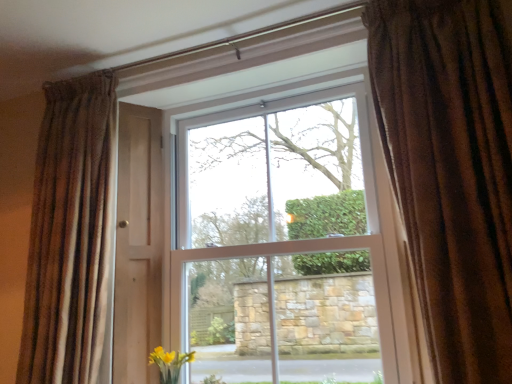
What is the approximate width of white plastic window at center?

white plastic window at center is 16.60 centimeters wide.

The height and width of the screenshot is (384, 512). What do you see at coordinates (451, 170) in the screenshot? I see `brown textured curtain at right, the 2th curtain when ordered from left to right` at bounding box center [451, 170].

Locate an element on the screen. The image size is (512, 384). brown textured curtain at left, which is the 1th curtain in left-to-right order is located at coordinates (71, 233).

The height and width of the screenshot is (384, 512). I want to click on white plastic window at center, so click(267, 231).

Is point (37, 329) closer or farther from the camera than point (158, 245)?

Clearly, point (37, 329) is closer to the camera than point (158, 245).

Consider the image. Is brown textured curtain at left, marked as the second curtain in a front-to-back arrangement, facing towards white plastic window at center?

No, brown textured curtain at left, marked as the second curtain in a front-to-back arrangement, is not facing towards white plastic window at center.

What's the angular difference between brown textured curtain at left, which is counted as the first curtain, starting from the back, and white plastic window at center's facing directions?

3.55 degrees separate the facing orientations of brown textured curtain at left, which is counted as the first curtain, starting from the back, and white plastic window at center.

Does brown textured curtain at left, which is counted as the first curtain, starting from the back, have a greater width compared to white plastic window at center?

Yes, brown textured curtain at left, which is counted as the first curtain, starting from the back, is wider than white plastic window at center.

Is brown textured curtain at right, the 2th curtain when ordered from left to right, wider or thinner than white plastic window at center?

In the image, brown textured curtain at right, the 2th curtain when ordered from left to right, appears to be wider than white plastic window at center.

Who is bigger, brown textured curtain at right, which ranks as the 1th curtain in front-to-back order, or white plastic window at center?

white plastic window at center is bigger.

Which is more to the left, brown textured curtain at right, which ranks as the 1th curtain in front-to-back order, or white plastic window at center?

From the viewer's perspective, white plastic window at center appears more on the left side.

At what (x,y) coordinates should I click in order to perform the action: click on window that is behind the brown textured curtain at right, the 2th curtain in the back-to-front sequence. Please return your answer as a coordinate pair (x, y). The image size is (512, 384). Looking at the image, I should click on (267, 231).

What's the angular difference between brown textured curtain at right, which ranks as the 1th curtain in front-to-back order, and brown textured curtain at left, which is the 1th curtain in left-to-right order,'s facing directions?

The facing directions of brown textured curtain at right, which ranks as the 1th curtain in front-to-back order, and brown textured curtain at left, which is the 1th curtain in left-to-right order, are 0.872 degrees apart.

Which object is thinner, brown textured curtain at right, the 2th curtain in the back-to-front sequence, or brown textured curtain at left, marked as the second curtain in a front-to-back arrangement?

With smaller width is brown textured curtain at left, marked as the second curtain in a front-to-back arrangement.

Considering the positions of point (424, 98) and point (106, 126), is point (424, 98) closer or farther from the camera than point (106, 126)?

Point (424, 98) is closer to the camera than point (106, 126).

Considering the sizes of objects brown textured curtain at right, the 2th curtain in the back-to-front sequence, and brown textured curtain at left, marked as the second curtain in a front-to-back arrangement, in the image provided, who is taller, brown textured curtain at right, the 2th curtain in the back-to-front sequence, or brown textured curtain at left, marked as the second curtain in a front-to-back arrangement,?

brown textured curtain at left, marked as the second curtain in a front-to-back arrangement.

Is white plastic window at center shorter than brown textured curtain at left, which is counted as the first curtain, starting from the back?

No.

Are white plastic window at center and brown textured curtain at left, which is counted as the first curtain, starting from the back, far apart?

No, white plastic window at center is in close proximity to brown textured curtain at left, which is counted as the first curtain, starting from the back.

Is point (274, 95) positioned in front of point (78, 262)?

No.

From a real-world perspective, which object stands above the other?

brown textured curtain at left, which appears as the 2th curtain when viewed from the right.

Can brown textured curtain at right, which ranks as the 1th curtain in front-to-back order, be found inside brown textured curtain at left, which is counted as the first curtain, starting from the back?

That's incorrect, brown textured curtain at right, which ranks as the 1th curtain in front-to-back order, is not inside brown textured curtain at left, which is counted as the first curtain, starting from the back.

Could you tell me if brown textured curtain at left, marked as the second curtain in a front-to-back arrangement, is facing brown textured curtain at right, the 2th curtain in the back-to-front sequence?

No, brown textured curtain at left, marked as the second curtain in a front-to-back arrangement, is not turned towards brown textured curtain at right, the 2th curtain in the back-to-front sequence.

Considering the sizes of objects brown textured curtain at left, marked as the second curtain in a front-to-back arrangement, and brown textured curtain at right, the 2th curtain when ordered from left to right, in the image provided, who is smaller, brown textured curtain at left, marked as the second curtain in a front-to-back arrangement, or brown textured curtain at right, the 2th curtain when ordered from left to right,?

With smaller size is brown textured curtain at left, marked as the second curtain in a front-to-back arrangement.

Is there a large distance between brown textured curtain at left, which is the 1th curtain in left-to-right order, and brown textured curtain at right, the 2th curtain in the back-to-front sequence?

Absolutely, brown textured curtain at left, which is the 1th curtain in left-to-right order, is distant from brown textured curtain at right, the 2th curtain in the back-to-front sequence.

Is white plastic window at center turned away from brown textured curtain at right, the 2th curtain in the back-to-front sequence?

No.

Considering the relative sizes of white plastic window at center and brown textured curtain at right, the 1th curtain in the right-to-left sequence, in the image provided, is white plastic window at center thinner than brown textured curtain at right, the 1th curtain in the right-to-left sequence,?

Yes, white plastic window at center is thinner than brown textured curtain at right, the 1th curtain in the right-to-left sequence.

Between white plastic window at center and brown textured curtain at right, the 2th curtain in the back-to-front sequence, which one is positioned behind?

white plastic window at center is further away from the camera.

From a real-world perspective, is white plastic window at center physically above brown textured curtain at right, which ranks as the 1th curtain in front-to-back order?

No, from a real-world perspective, white plastic window at center is not over brown textured curtain at right, which ranks as the 1th curtain in front-to-back order

Where is `the 1st curtain directly above the white plastic window at center (from a real-world perspective)`? the 1st curtain directly above the white plastic window at center (from a real-world perspective) is located at coordinates (71, 233).

Locate an element on the screen. The height and width of the screenshot is (384, 512). window on the left of brown textured curtain at right, the 1th curtain in the right-to-left sequence is located at coordinates (267, 231).

Based on their spatial positions, is white plastic window at center or brown textured curtain at left, which appears as the 2th curtain when viewed from the right, further from brown textured curtain at right, the 2th curtain when ordered from left to right?

brown textured curtain at left, which appears as the 2th curtain when viewed from the right, is positioned further to the anchor brown textured curtain at right, the 2th curtain when ordered from left to right.

When comparing their distances from brown textured curtain at left, which appears as the 2th curtain when viewed from the right, does brown textured curtain at right, the 1th curtain in the right-to-left sequence, or white plastic window at center seem further?

Based on the image, brown textured curtain at right, the 1th curtain in the right-to-left sequence, appears to be further to brown textured curtain at left, which appears as the 2th curtain when viewed from the right.

In the scene shown: Looking at the image, which one is located further to brown textured curtain at right, the 2th curtain in the back-to-front sequence, brown textured curtain at left, which appears as the 2th curtain when viewed from the right, or white plastic window at center?

brown textured curtain at left, which appears as the 2th curtain when viewed from the right.

Which object lies nearer to the anchor point white plastic window at center, brown textured curtain at left, which is counted as the first curtain, starting from the back, or brown textured curtain at right, which ranks as the 1th curtain in front-to-back order?

brown textured curtain at left, which is counted as the first curtain, starting from the back, is positioned closer to the anchor white plastic window at center.

Looking at the image, which one is located further to brown textured curtain at left, marked as the second curtain in a front-to-back arrangement, white plastic window at center or brown textured curtain at right, the 1th curtain in the right-to-left sequence?

brown textured curtain at right, the 1th curtain in the right-to-left sequence, lies further to brown textured curtain at left, marked as the second curtain in a front-to-back arrangement, than the other object.

Which object lies nearer to the anchor point white plastic window at center, brown textured curtain at right, the 2th curtain in the back-to-front sequence, or brown textured curtain at left, which is the 1th curtain in left-to-right order?

Based on the image, brown textured curtain at left, which is the 1th curtain in left-to-right order, appears to be nearer to white plastic window at center.

This screenshot has height=384, width=512. Find the location of `window between brown textured curtain at left, which is counted as the first curtain, starting from the back, and brown textured curtain at right, which ranks as the 1th curtain in front-to-back order, in the horizontal direction`. window between brown textured curtain at left, which is counted as the first curtain, starting from the back, and brown textured curtain at right, which ranks as the 1th curtain in front-to-back order, in the horizontal direction is located at coordinates (267, 231).